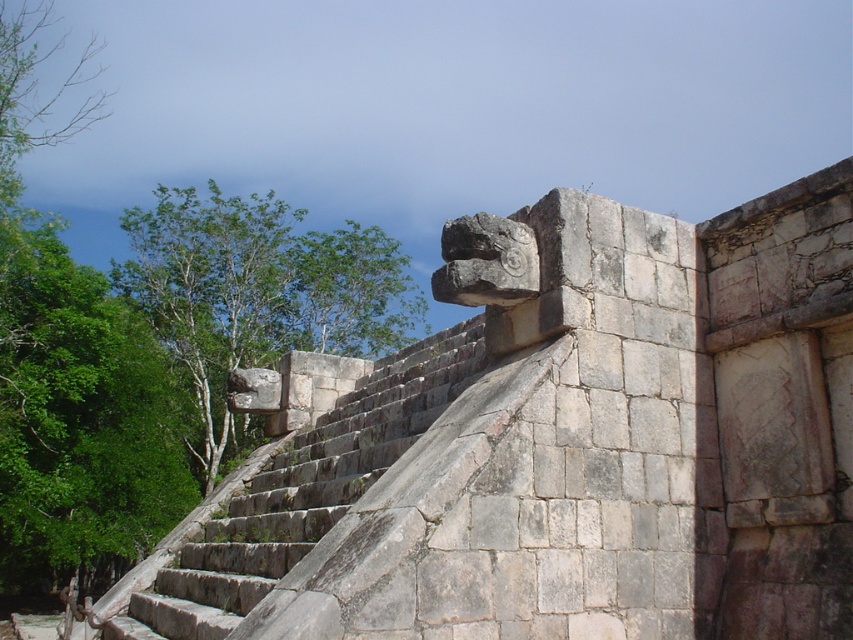
You are an archaeologist examining the ancient stone structure. You notice the gray stone carving at upper center and the green leafy tree at left. Which object appears shorter in the image?

The gray stone carving at upper center is not as tall as the green leafy tree at left, so the gray stone carving at upper center appears shorter.

You are standing at the base of the ancient stone structure and want to take a photo of the point at coordinates point (x=712, y=376). If your camera has a maximum zoom range of 30 meters, will you be able to capture the point in your photo?

The point (x=712, y=376) is 27.42 meters away from the camera, which is within the camera maximum zoom range of 30 meters. Therefore, you can capture the point in your photo.